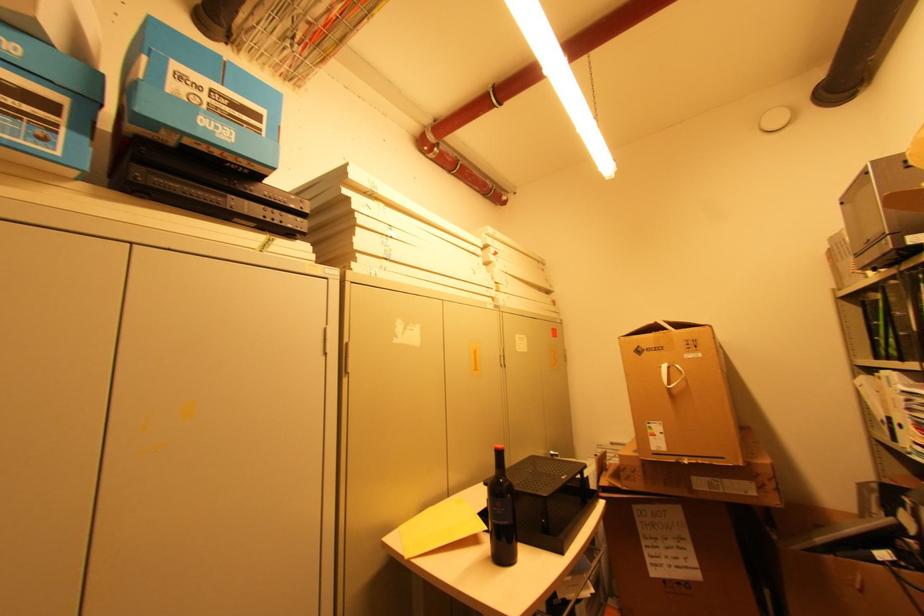
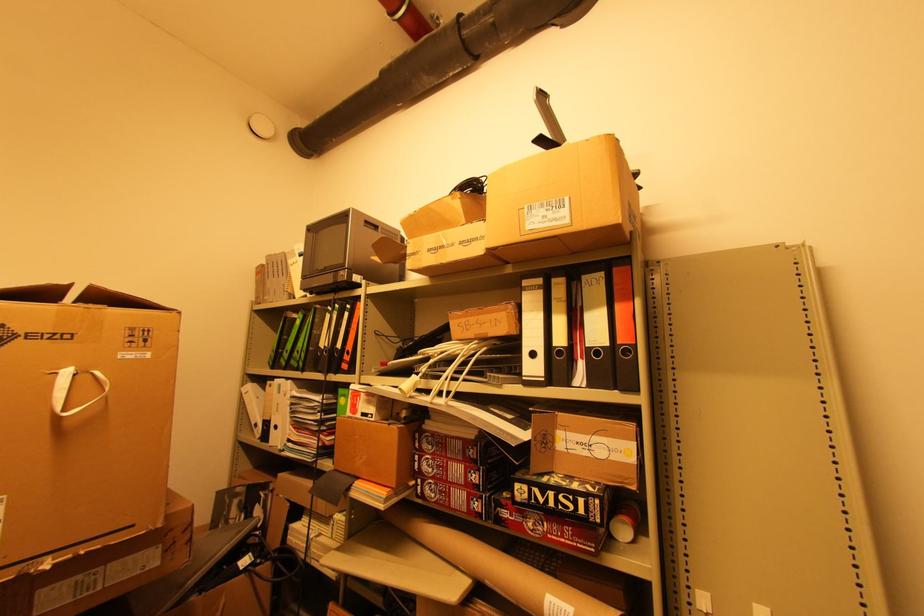
Find the pixel in the second image that matches pixel 681 367 in the first image.

(101, 373)